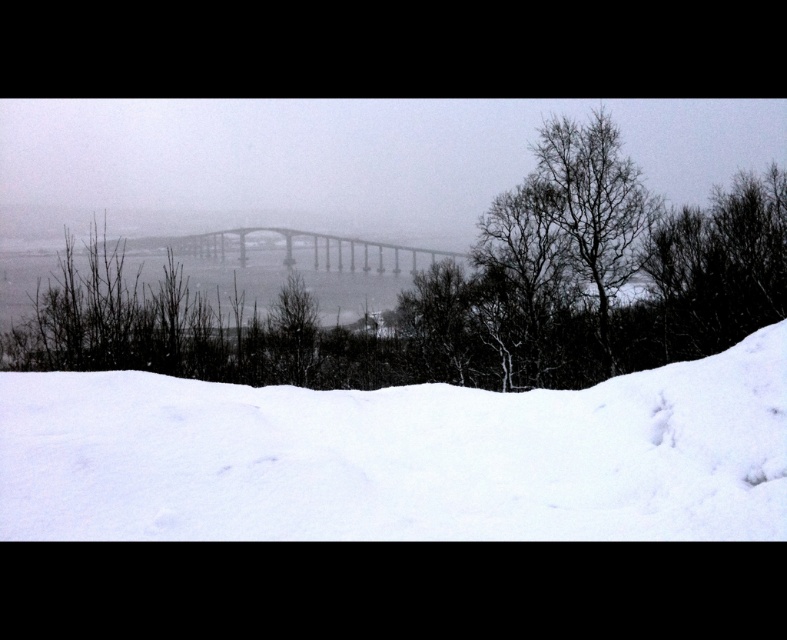
You are standing at the edge of the snowy area and want to cross the gray metallic bridge at center. Based on the scene, can you determine if the white snow at lower center is blocking your path to the bridge?

The white snow at lower center is in front of the gray metallic bridge at center, so it is blocking the path to the bridge.

You are standing at the point marked by the coordinates point (401, 458) in the winter landscape. What is the terrain like at this location?

The point (401, 458) marks white snow at lower center, so the terrain at this location is covered in thick, undisturbed snow with a smooth but slightly uneven texture.

You are an artist planning to paint this winter scene. You want to ensure the white snow at lower center and the gray metallic bridge at center are proportionally accurate. Which object should you paint first if you are starting from the largest to the smallest?

The gray metallic bridge at center should be painted first because it is larger than the white snow at lower center according to the description.